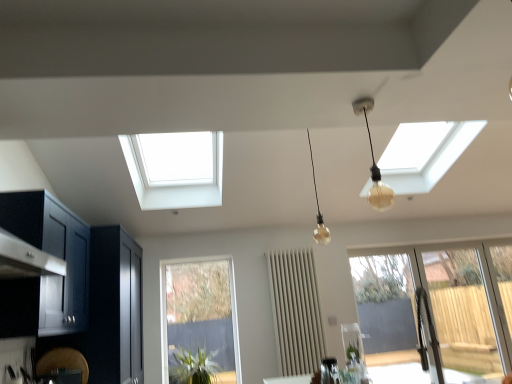
Question: From the image's perspective, is metallic silver kettle at center located above matte glass bulb at center, acting as the 1th lamp starting from the back?

Choices:
 (A) no
 (B) yes

Answer: (A)

Question: Is the position of metallic silver kettle at center less distant than that of matte glass bulb at center, acting as the 1th lamp starting from the back?

Choices:
 (A) yes
 (B) no

Answer: (A)

Question: Could you tell me if metallic silver kettle at center is turned towards matte glass bulb at center, which appears as the second lamp when viewed from the front?

Choices:
 (A) no
 (B) yes

Answer: (A)

Question: From a real-world perspective, is metallic silver kettle at center located higher than matte glass bulb at center, acting as the 1th lamp starting from the back?

Choices:
 (A) no
 (B) yes

Answer: (A)

Question: From a real-world perspective, does metallic silver kettle at center sit lower than matte glass bulb at center, acting as the 1th lamp starting from the back?

Choices:
 (A) yes
 (B) no

Answer: (A)

Question: Would you say metallic silver kettle at center is to the left or to the right of clear glass window at lower center, which is the 2th window from right to left, in the picture?

Choices:
 (A) left
 (B) right

Answer: (B)

Question: Is point (x=333, y=375) closer or farther from the camera than point (x=212, y=269)?

Choices:
 (A) closer
 (B) farther

Answer: (A)

Question: Is metallic silver kettle at center bigger or smaller than clear glass window at lower center, the 1th window positioned from the left?

Choices:
 (A) small
 (B) big

Answer: (A)

Question: Relative to clear glass window at lower center, which is the 2th window from right to left, is metallic silver kettle at center in front or behind?

Choices:
 (A) behind
 (B) front

Answer: (B)

Question: Is point (188, 271) closer or farther from the camera than point (286, 362)?

Choices:
 (A) closer
 (B) farther

Answer: (B)

Question: In the image, is clear glass window at lower center, the 1th window positioned from the left, on the left side or the right side of beige fabric radiator at center?

Choices:
 (A) right
 (B) left

Answer: (B)

Question: Looking at their shapes, would you say clear glass window at lower center, which is the 2th window from right to left, is wider or thinner than beige fabric radiator at center?

Choices:
 (A) thin
 (B) wide

Answer: (A)

Question: Considering their positions, is clear glass window at lower center, which is the 2th window from right to left, located in front of or behind beige fabric radiator at center?

Choices:
 (A) behind
 (B) front

Answer: (A)

Question: Considering the positions of clear glass window at lower center, the 1th window positioned from the left, and clear glass door at lower right, marked as the first window in a right-to-left arrangement, in the image, is clear glass window at lower center, the 1th window positioned from the left, wider or thinner than clear glass door at lower right, marked as the first window in a right-to-left arrangement,?

Choices:
 (A) wide
 (B) thin

Answer: (B)

Question: From their relative heights in the image, would you say clear glass window at lower center, the 1th window positioned from the left, is taller or shorter than clear glass door at lower right, marked as the first window in a right-to-left arrangement?

Choices:
 (A) short
 (B) tall

Answer: (A)